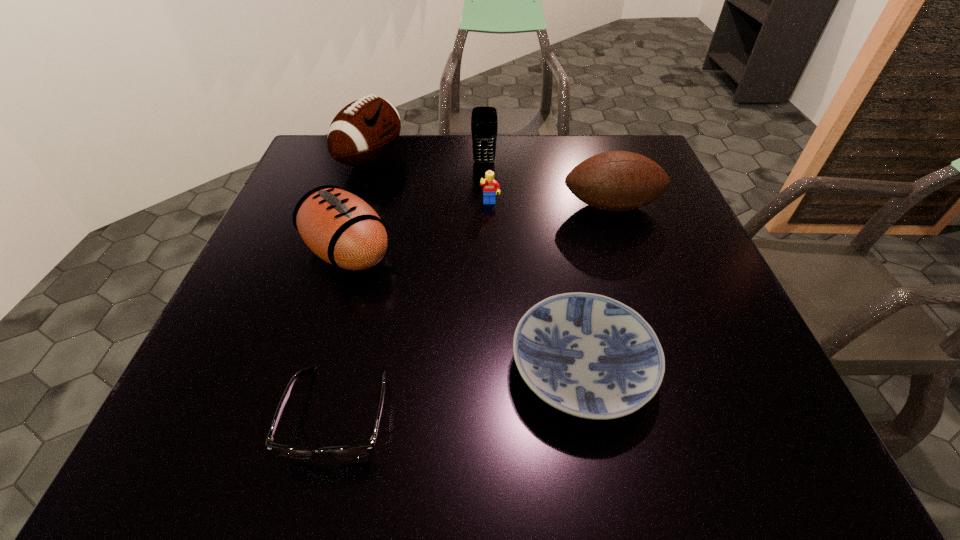
Locate an element on the screen. The width and height of the screenshot is (960, 540). free region at the far left corner of the desktop is located at coordinates (306, 179).

In the image, there is a desktop. Where is `vacant space at the near left corner`? The image size is (960, 540). vacant space at the near left corner is located at coordinates (222, 425).

Where is `free spot between the plate and the farthest football (American)`? The height and width of the screenshot is (540, 960). free spot between the plate and the farthest football (American) is located at coordinates (476, 264).

I want to click on free space between the tallest football (American) and the cellular telephone, so click(x=427, y=160).

Where is `empty space between the spectacles and the tallest football (American)`? The image size is (960, 540). empty space between the spectacles and the tallest football (American) is located at coordinates (355, 286).

Find the location of a particular element. The width and height of the screenshot is (960, 540). unoccupied position between the cellular telephone and the plate is located at coordinates (533, 265).

Find the location of `vacant space that's between the spectacles and the Lego`. vacant space that's between the spectacles and the Lego is located at coordinates (415, 308).

Where is `object that is the second closest to the cellular telephone`? The height and width of the screenshot is (540, 960). object that is the second closest to the cellular telephone is located at coordinates (364, 131).

This screenshot has width=960, height=540. In order to click on object identified as the fourth closest to the fifth tallest object in this screenshot , I will do pyautogui.click(x=364, y=131).

You are a GUI agent. You are given a task and a screenshot of the screen. Output one action in this format:
    pyautogui.click(x=<x>, y=<y>)
    Task: Click on the football (American) that is the nearest to the rightmost football (American)
    The image size is (960, 540).
    Given the screenshot: What is the action you would take?
    pyautogui.click(x=339, y=227)